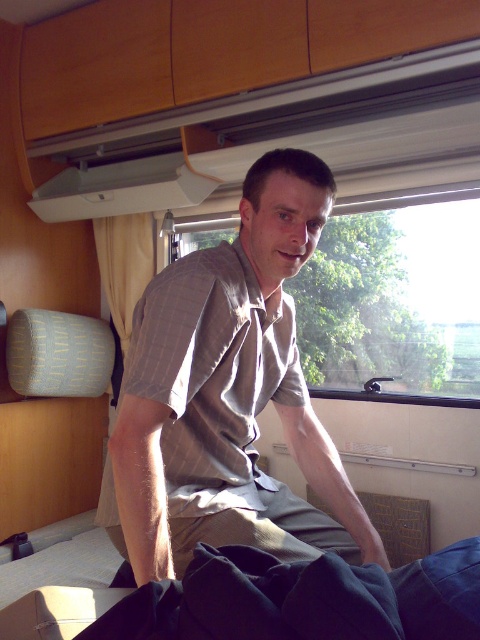
Question: Is gray striped shirt at center to the left of transparent glass window at center from the viewer's perspective?

Choices:
 (A) no
 (B) yes

Answer: (B)

Question: Considering the relative positions of gray striped shirt at center and transparent glass window at center in the image provided, where is gray striped shirt at center located with respect to transparent glass window at center?

Choices:
 (A) below
 (B) above

Answer: (A)

Question: Is gray striped shirt at center bigger than transparent glass window at center?

Choices:
 (A) no
 (B) yes

Answer: (A)

Question: Which point is farther from the camera taking this photo?

Choices:
 (A) coord(470,392)
 (B) coord(228,314)

Answer: (A)